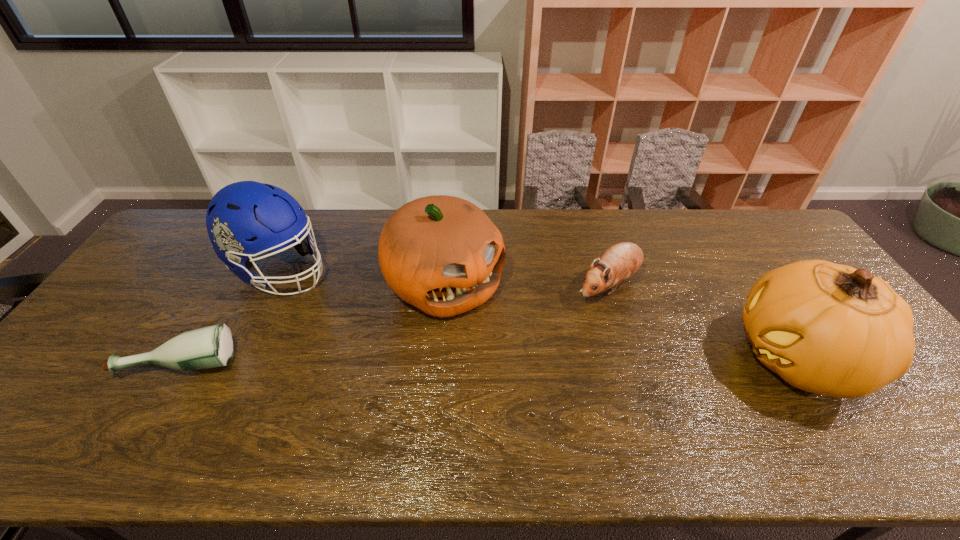
Identify the location of the shortest object. (213, 346).

The height and width of the screenshot is (540, 960). In order to click on the right pumpkin in this screenshot , I will do `click(826, 328)`.

Where is `the third object from right to left`? The height and width of the screenshot is (540, 960). the third object from right to left is located at coordinates (442, 254).

Locate an element on the screen. Image resolution: width=960 pixels, height=540 pixels. the fourth tallest object is located at coordinates (620, 261).

Locate an element on the screen. Image resolution: width=960 pixels, height=540 pixels. hamster is located at coordinates 620,261.

Find the location of a particular element. football helmet is located at coordinates (244, 219).

Locate an element on the screen. vacant space situated 0.200m on the back of the shortest object is located at coordinates (226, 289).

Identify the location of vacant space located 0.290m on the front face of the right pumpkin. (619, 358).

Identify the location of vacant area situated on the front face of the right pumpkin. (658, 358).

Identify the location of blank area located 0.060m on the front face of the right pumpkin. (708, 358).